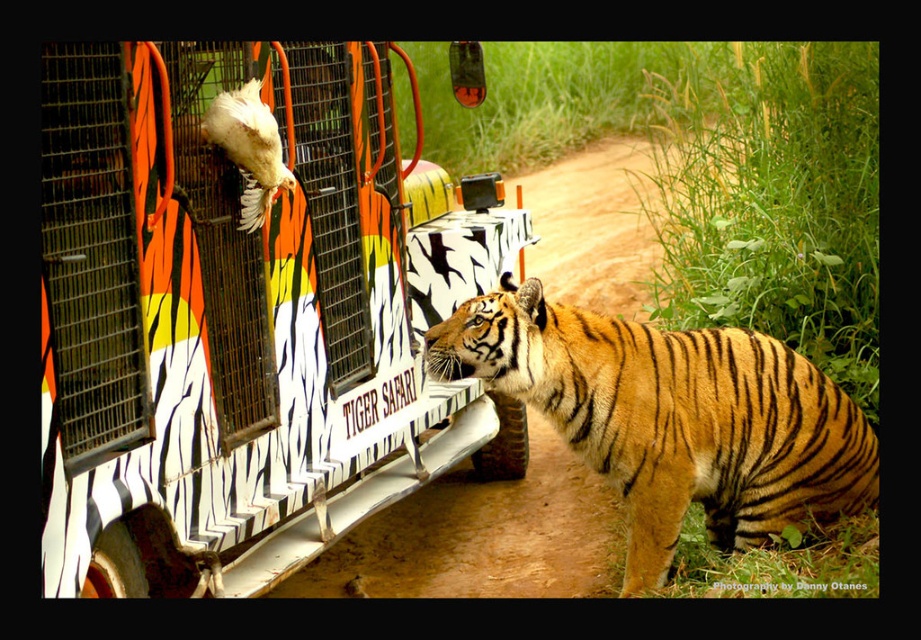
Question: Which object is positioned closest to the brown dirt track at center?

Choices:
 (A) zebra-striped truck at center
 (B) orange-yellow fur tiger at center

Answer: (B)

Question: Is orange-yellow fur tiger at center wider than white fluffy chicken at upper left?

Choices:
 (A) no
 (B) yes

Answer: (B)

Question: Which object is positioned farthest from the orange-yellow fur tiger at center?

Choices:
 (A) brown dirt track at center
 (B) white fluffy chicken at upper left

Answer: (A)

Question: Which point is closer to the camera?

Choices:
 (A) coord(246,106)
 (B) coord(663,394)
 (C) coord(239,579)

Answer: (A)

Question: Does zebra-striped truck at center appear on the right side of brown dirt track at center?

Choices:
 (A) yes
 (B) no

Answer: (B)

Question: From the image, what is the correct spatial relationship of zebra-striped truck at center in relation to orange-yellow fur tiger at center?

Choices:
 (A) right
 (B) left

Answer: (B)